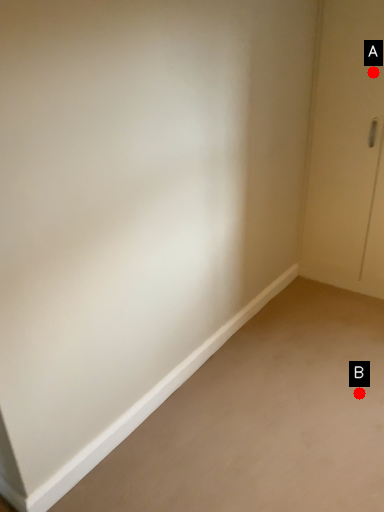
Question: Two points are circled on the image, labeled by A and B beside each circle. Which point appears closest to the camera in this image?

Choices:
 (A) A is closer
 (B) B is closer

Answer: (B)